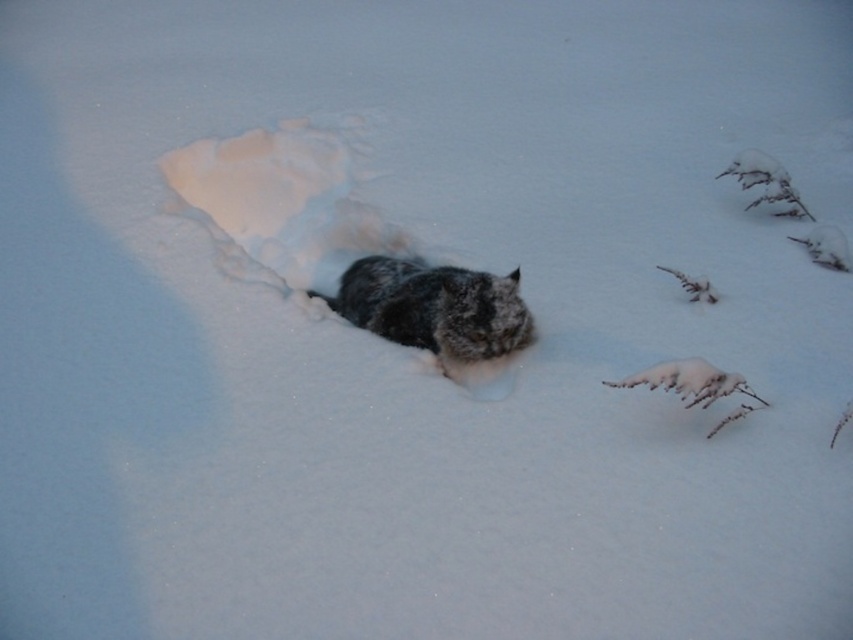
You are a photographer trying to capture the cat in the snow. You notice the white fluffy snow at center and the fuzzy fur cat at center. Which object is located more to the left in the image?

The white fluffy snow at center is positioned on the left side of the fuzzy fur cat at center, so it is more to the left.

You are standing at the origin point in the winter scene. There is a cat partially buried in the snow and a white fluffy snow at center located at point [286,200]. Which object is closer to you?

The white fluffy snow at center located at point [286,200] is closer to you because it is positioned at the specified coordinates, while the cat is partially buried further back in the snow.